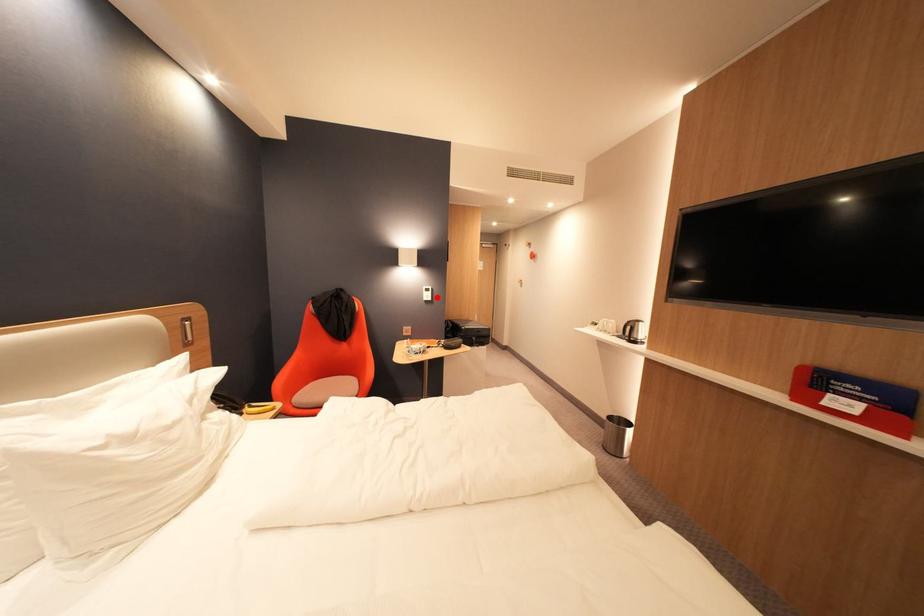
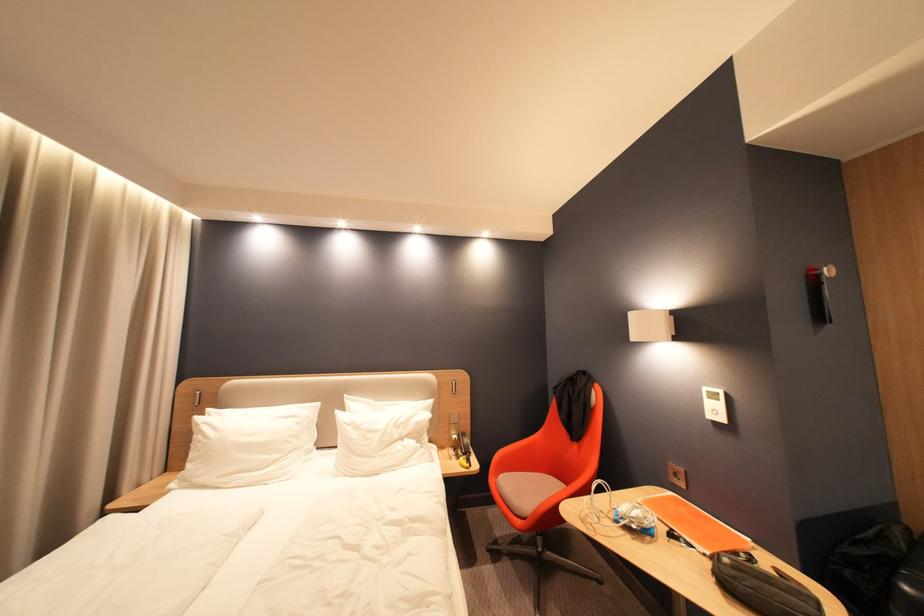
Find the pixel in the second image that matches the highlighted location in the first image.

(724, 413)